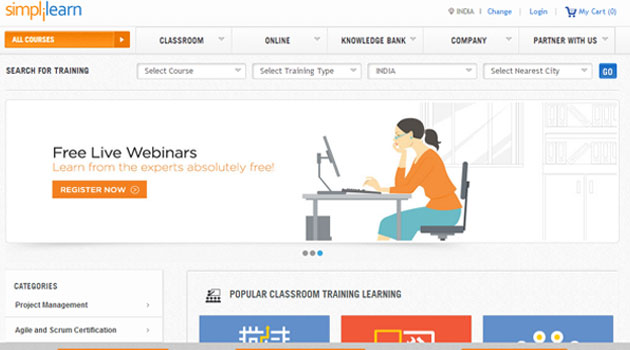
Find the location of a particular element. Image resolution: width=630 pixels, height=350 pixels. computer is located at coordinates (331, 157).